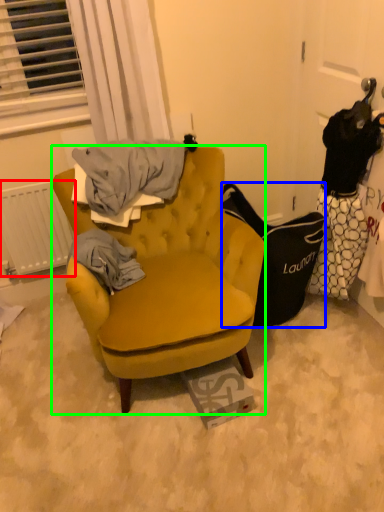
Question: Considering the real-world distances, which object is closest to radiator (highlighted by a red box)? handbag (highlighted by a blue box) or chair (highlighted by a green box).

Choices:
 (A) handbag
 (B) chair

Answer: (B)